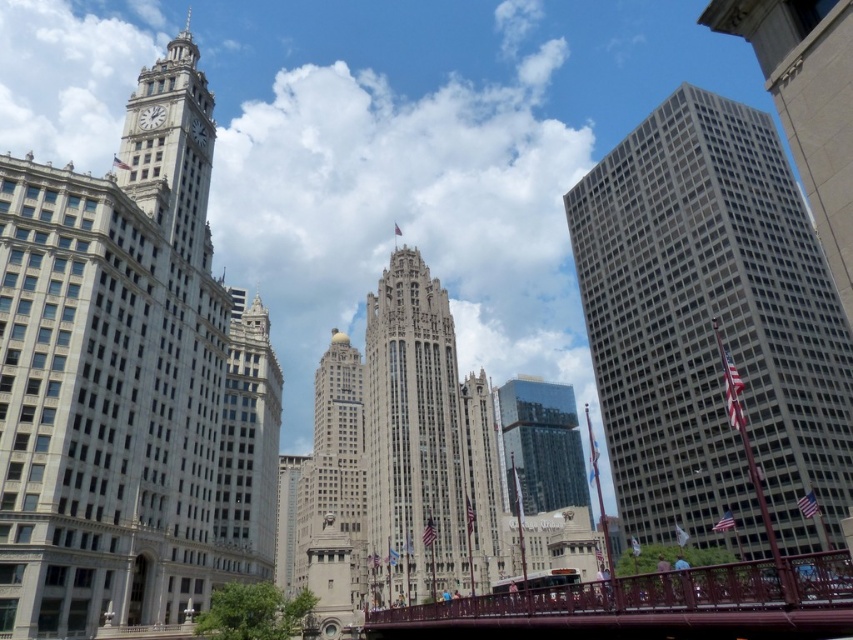
You are standing in the middle of the street looking at the buildings. Which of the two objects, the white stone clock tower at upper left or the glassy reflective skyscraper at center, is positioned to the left of the other?

The white stone clock tower at upper left is positioned to the left of the glassy reflective skyscraper at center.